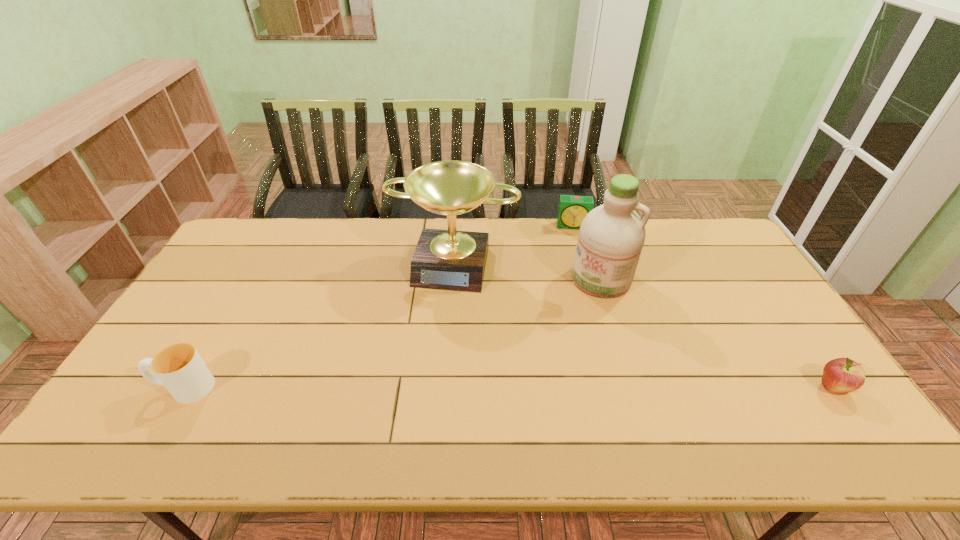
Select which object appears as the fourth closest to the farthest object. Please provide its 2D coordinates. Your answer should be formatted as a tuple, i.e. [(x, y)], where the tuple contains the x and y coordinates of a point satisfying the conditions above.

[(179, 367)]

Locate an element on the screen. free location that satisfies the following two spatial constraints: 1. on the front side of the cleansing agent; 2. on the left side of the apple is located at coordinates (634, 388).

At what (x,y) coordinates should I click in order to perform the action: click on vacant space that satisfies the following two spatial constraints: 1. on the front side of the rightmost object; 2. on the right side of the cleansing agent. Please return your answer as a coordinate pair (x, y). This screenshot has width=960, height=540. Looking at the image, I should click on (634, 388).

Where is `free location that satisfies the following two spatial constraints: 1. on the front side of the tallest object; 2. on the left side of the rightmost object`? The image size is (960, 540). free location that satisfies the following two spatial constraints: 1. on the front side of the tallest object; 2. on the left side of the rightmost object is located at coordinates (634, 388).

Locate an element on the screen. This screenshot has width=960, height=540. free space that satisfies the following two spatial constraints: 1. on the front side of the cleansing agent; 2. on the left side of the alarm clock is located at coordinates (588, 279).

You are a GUI agent. You are given a task and a screenshot of the screen. Output one action in this format:
    pyautogui.click(x=<x>, y=<y>)
    Task: Click on the vacant space that satisfies the following two spatial constraints: 1. on the back side of the farthest object; 2. on the left side of the second tallest object
    This screenshot has height=540, width=960.
    Given the screenshot: What is the action you would take?
    pyautogui.click(x=456, y=226)